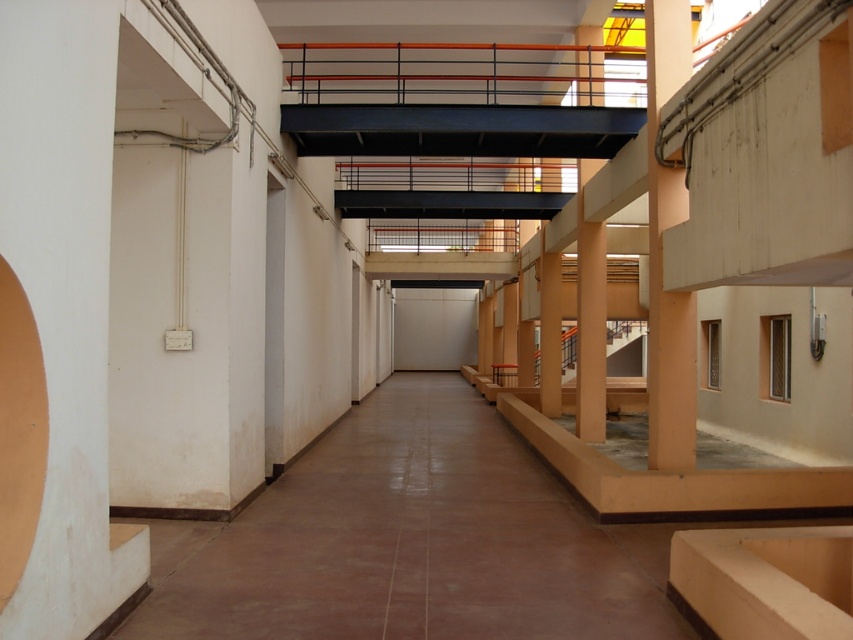
Question: Is orange matte column at center smaller than orange matte/rough pillar at center-right?

Choices:
 (A) no
 (B) yes

Answer: (B)

Question: Where is orange matte pillar at right located in relation to orange matte/rough pillar at center-right in the image?

Choices:
 (A) right
 (B) left

Answer: (A)

Question: Is orange matte column at center above orange matte/rough pillar at center-right?

Choices:
 (A) yes
 (B) no

Answer: (A)

Question: Which object appears farthest from the camera in this image?

Choices:
 (A) orange matte column at center
 (B) orange matte pillar at right
 (C) orange matte/rough pillar at center-right

Answer: (C)

Question: Considering the real-world distances, which object is closest to the orange matte/rough pillar at center-right?

Choices:
 (A) orange matte column at center
 (B) orange matte pillar at right

Answer: (A)

Question: Which of the following is the closest to the observer?

Choices:
 (A) pos(546,404)
 (B) pos(592,362)

Answer: (B)